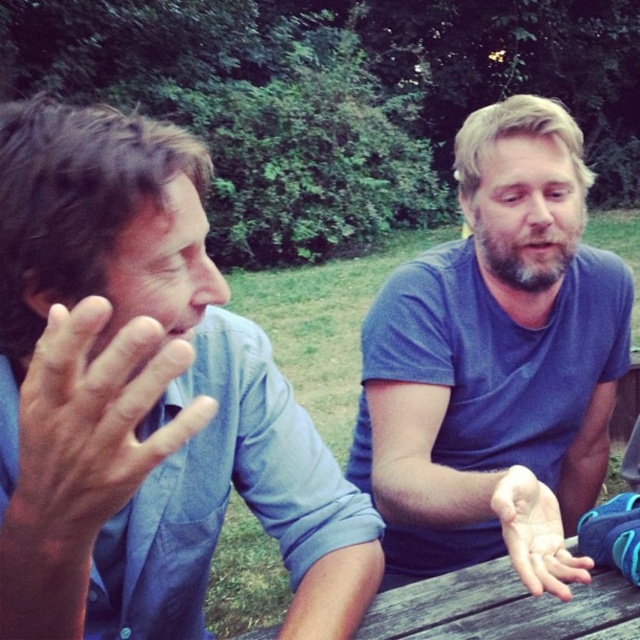
Between blue cotton shirt at center and matte blue shirt at left, which one is positioned higher?

matte blue shirt at left is higher up.

Based on the photo, is blue cotton shirt at center to the left of matte blue shirt at left from the viewer's perspective?

No, blue cotton shirt at center is not to the left of matte blue shirt at left.

Between point (476, 282) and point (51, 417), which one is positioned in front?

Point (51, 417)

Where is `blue cotton shirt at center`? blue cotton shirt at center is located at coordinates (497, 364).

Which is more to the right, blue cotton shirt at left or blue cotton shirt at center?

From the viewer's perspective, blue cotton shirt at center appears more on the right side.

Which is in front, point (88, 508) or point (573, 504)?

Point (88, 508) is in front.

Who is more forward, (60, 628) or (566, 196)?

Point (60, 628) is more forward.

This screenshot has height=640, width=640. In order to click on blue cotton shirt at left in this screenshot , I will do `click(144, 400)`.

Can you confirm if blue cotton shirt at left is positioned above smooth skin hand at center?

Correct, blue cotton shirt at left is located above smooth skin hand at center.

Between blue cotton shirt at left and smooth skin hand at center, which one appears on the left side from the viewer's perspective?

Positioned to the left is blue cotton shirt at left.

The width and height of the screenshot is (640, 640). What are the coordinates of `blue cotton shirt at left` in the screenshot? It's located at (144, 400).